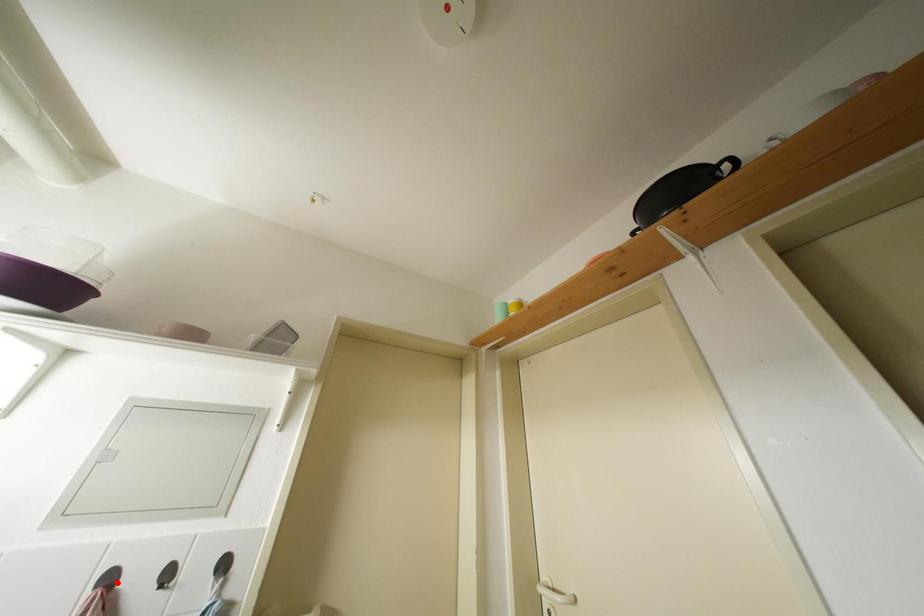
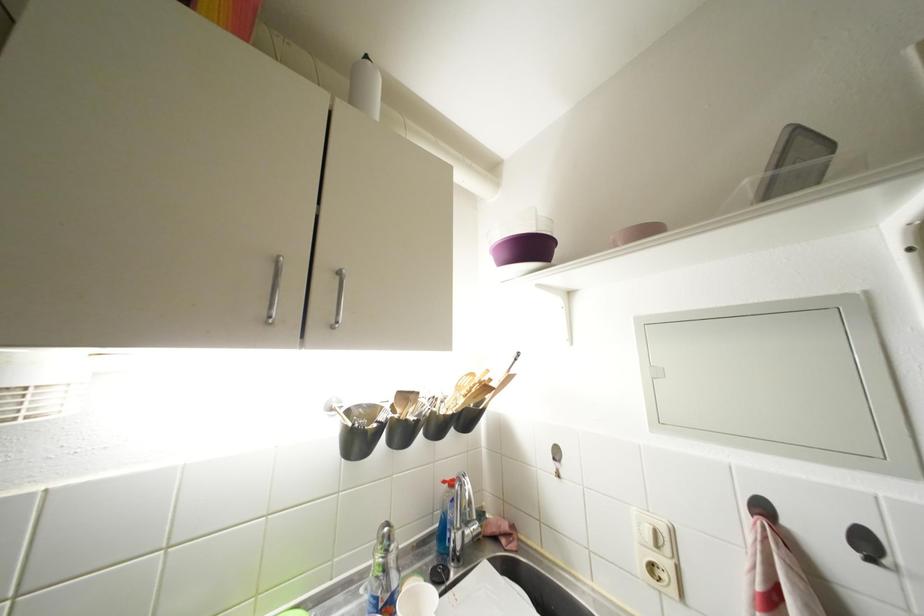
The point at the highlighted location is marked in the first image. Where is the corresponding point in the second image?

(770, 513)